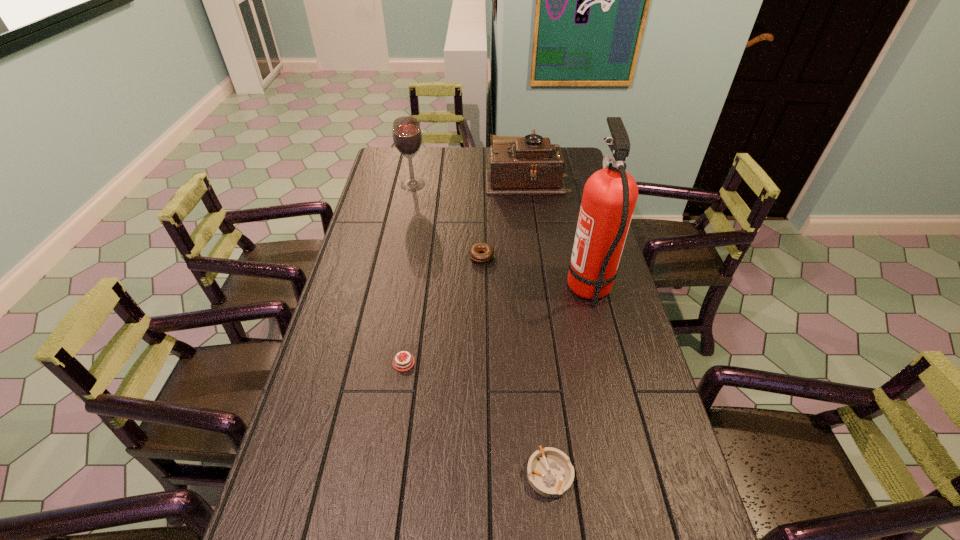
Locate an element on the screen. vacant area between the ashtray and the doughnut is located at coordinates (516, 365).

What are the coordinates of `vacant area that lies between the doughnut and the phonograph_record` in the screenshot? It's located at pyautogui.click(x=504, y=217).

You are a GUI agent. You are given a task and a screenshot of the screen. Output one action in this format:
    pyautogui.click(x=<x>, y=<y>)
    Task: Click on the unoccupied position between the fifth shortest object and the phonograph_record
    Image resolution: width=960 pixels, height=540 pixels.
    Given the screenshot: What is the action you would take?
    pyautogui.click(x=470, y=181)

Where is `free spot between the doughnut and the alcohol`? free spot between the doughnut and the alcohol is located at coordinates (447, 220).

Where is `free space that is in between the fifth farthest object and the ashtray`? free space that is in between the fifth farthest object and the ashtray is located at coordinates (476, 418).

Locate which object is the fifth closest to the tallest object. Please provide its 2D coordinates. Your answer should be formatted as a tuple, i.e. [(x, y)], where the tuple contains the x and y coordinates of a point satisfying the conditions above.

[(407, 136)]

Identify which object is the fifth closest to the phonograph_record. Please provide its 2D coordinates. Your answer should be formatted as a tuple, i.e. [(x, y)], where the tuple contains the x and y coordinates of a point satisfying the conditions above.

[(550, 473)]

I want to click on vacant position in the image that satisfies the following two spatial constraints: 1. on the horn of the phonograph_record; 2. on the front side of the doughnut, so click(539, 256).

Find the location of a particular element. vacant space that satisfies the following two spatial constraints: 1. on the front side of the fifth farthest object; 2. on the left side of the second tallest object is located at coordinates (377, 362).